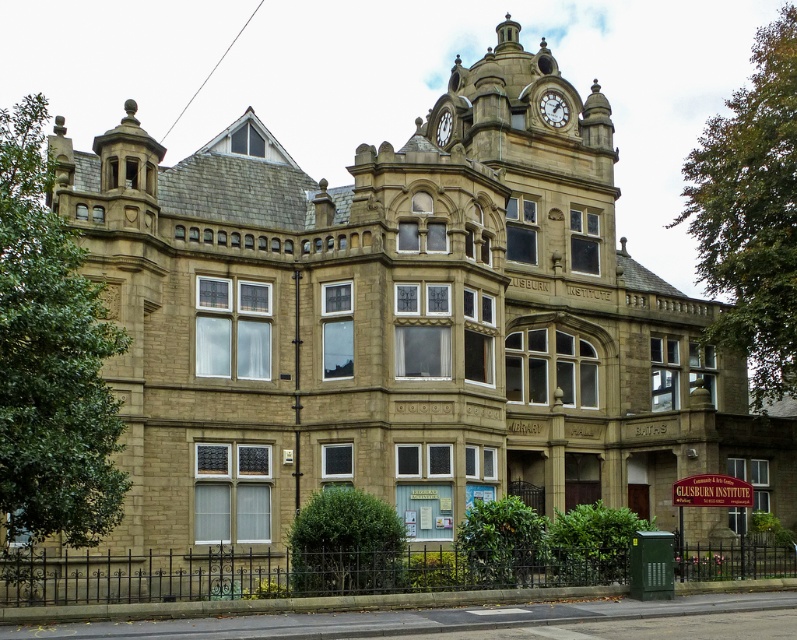
Describe the element at coordinates (552, 108) in the screenshot. The image size is (797, 640). I see `gold textured clock at upper center` at that location.

Which is behind, point (559, 97) or point (450, 128)?

Point (559, 97)

Identify the location of gold textured clock at upper center. (552, 108).